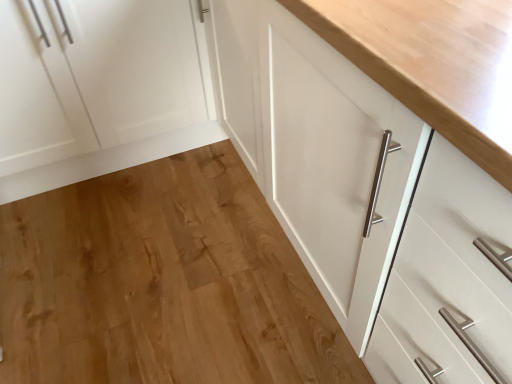
Question: Is natural wood floor at center in contact with white matte cabinet at left?

Choices:
 (A) no
 (B) yes

Answer: (A)

Question: Does natural wood floor at center turn towards white matte cabinet at left?

Choices:
 (A) no
 (B) yes

Answer: (A)

Question: From the image's perspective, would you say natural wood floor at center is positioned over white matte cabinet at left?

Choices:
 (A) yes
 (B) no

Answer: (B)

Question: Is white matte cabinet at left located within natural wood floor at center?

Choices:
 (A) no
 (B) yes

Answer: (A)

Question: Can you confirm if natural wood floor at center is shorter than white matte cabinet at left?

Choices:
 (A) no
 (B) yes

Answer: (B)

Question: Does natural wood floor at center appear on the right side of white matte cabinet at left?

Choices:
 (A) no
 (B) yes

Answer: (B)

Question: Is white matte cabinet at left positioned behind natural wood floor at center?

Choices:
 (A) no
 (B) yes

Answer: (B)

Question: Considering the relative sizes of white matte cabinet at left and natural wood floor at center in the image provided, is white matte cabinet at left smaller than natural wood floor at center?

Choices:
 (A) no
 (B) yes

Answer: (A)

Question: From the image's perspective, is white matte cabinet at left on top of natural wood floor at center?

Choices:
 (A) no
 (B) yes

Answer: (B)

Question: Is white matte cabinet at left wider than natural wood floor at center?

Choices:
 (A) no
 (B) yes

Answer: (A)

Question: Is white matte cabinet at left touching natural wood floor at center?

Choices:
 (A) yes
 (B) no

Answer: (B)

Question: Can you confirm if white matte cabinet at left is bigger than natural wood floor at center?

Choices:
 (A) yes
 (B) no

Answer: (A)

Question: Is white matte cabinet at left taller or shorter than natural wood floor at center?

Choices:
 (A) tall
 (B) short

Answer: (A)